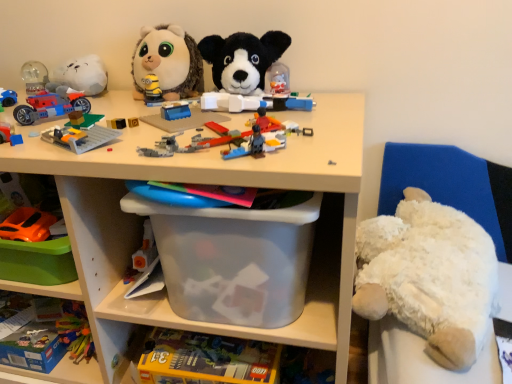
Question: Is white plush bear at right turned away from matte plastic car at left, the third toy in the bottom-to-top sequence?

Choices:
 (A) yes
 (B) no

Answer: (B)

Question: From a real-world perspective, is white plush bear at right physically above matte plastic car at left, the third toy in the bottom-to-top sequence?

Choices:
 (A) no
 (B) yes

Answer: (A)

Question: Can you confirm if white plush bear at right is positioned to the right of matte plastic car at left, the third toy in the bottom-to-top sequence?

Choices:
 (A) no
 (B) yes

Answer: (B)

Question: Is white plush bear at right next to matte plastic car at left, the third toy in the bottom-to-top sequence?

Choices:
 (A) no
 (B) yes

Answer: (A)

Question: Is white plush bear at right smaller than matte plastic car at left, which is the fifth toy from top to bottom?

Choices:
 (A) no
 (B) yes

Answer: (A)

Question: Is the depth of white plush bear at right greater than that of matte plastic car at left, the third toy in the bottom-to-top sequence?

Choices:
 (A) yes
 (B) no

Answer: (A)

Question: Is translucent plastic container at lower center, the second toy positioned from the bottom, at the left side of matte plastic car at left, the third toy in the bottom-to-top sequence?

Choices:
 (A) no
 (B) yes

Answer: (A)

Question: Is translucent plastic container at lower center, which appears as the 6th toy when viewed from the top, in contact with matte plastic car at left, the third toy in the bottom-to-top sequence?

Choices:
 (A) no
 (B) yes

Answer: (A)

Question: From the image's perspective, is translucent plastic container at lower center, the second toy positioned from the bottom, on matte plastic car at left, which is the fifth toy from top to bottom?

Choices:
 (A) yes
 (B) no

Answer: (B)

Question: From a real-world perspective, is translucent plastic container at lower center, which appears as the 6th toy when viewed from the top, below matte plastic car at left, which is the fifth toy from top to bottom?

Choices:
 (A) yes
 (B) no

Answer: (A)

Question: Considering the relative positions of translucent plastic container at lower center, which appears as the 6th toy when viewed from the top, and matte plastic car at left, which is the fifth toy from top to bottom, in the image provided, is translucent plastic container at lower center, which appears as the 6th toy when viewed from the top, to the right of matte plastic car at left, which is the fifth toy from top to bottom, from the viewer's perspective?

Choices:
 (A) no
 (B) yes

Answer: (B)

Question: Is matte plastic car at left, the third toy in the bottom-to-top sequence, inside translucent plastic container at lower center, which appears as the 6th toy when viewed from the top?

Choices:
 (A) yes
 (B) no

Answer: (B)

Question: From the image's perspective, is transparent plastic container at center, positioned as the first shelf in top-to-bottom order, over matte plastic car at left, the third toy in the bottom-to-top sequence?

Choices:
 (A) yes
 (B) no

Answer: (B)